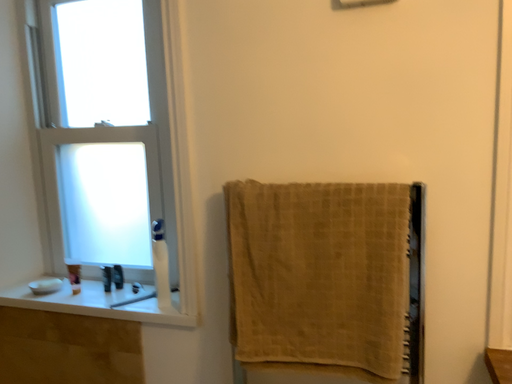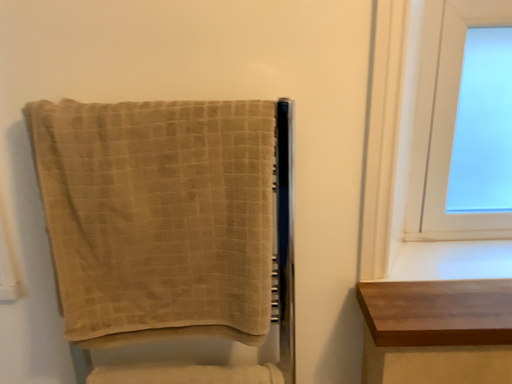
Question: How did the camera likely rotate when shooting the video?

Choices:
 (A) rotated downward
 (B) rotated upward

Answer: (A)